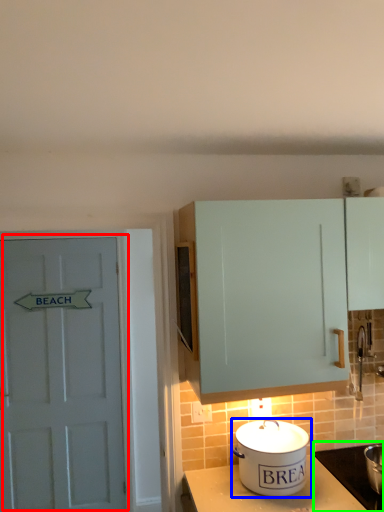
Question: Considering the real-world distances, which object is farthest from door (highlighted by a red box)? kitchen appliance (highlighted by a blue box) or appliance (highlighted by a green box)?

Choices:
 (A) kitchen appliance
 (B) appliance

Answer: (B)